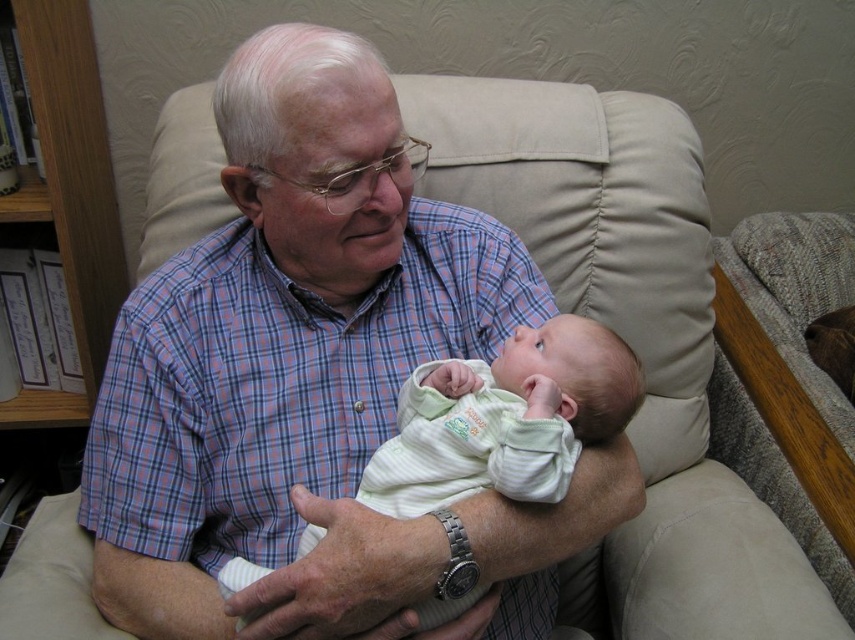
Is plaid shirt at center taller than wooden bookshelf at left?

Incorrect, plaid shirt at center's height is not larger of wooden bookshelf at left's.

Is plaid shirt at center to the right of wooden bookshelf at left from the viewer's perspective?

Indeed, plaid shirt at center is positioned on the right side of wooden bookshelf at left.

Which is in front, point (154, 582) or point (97, 342)?

Positioned in front is point (154, 582).

Locate an element on the screen. plaid shirt at center is located at coordinates (313, 380).

Can you confirm if plaid shirt at center is positioned to the left of light green striped fabric baby at center?

Correct, you'll find plaid shirt at center to the left of light green striped fabric baby at center.

Can you confirm if plaid shirt at center is taller than light green striped fabric baby at center?

Yes, plaid shirt at center is taller than light green striped fabric baby at center.

Which is behind, point (381, 636) or point (497, 486)?

Positioned behind is point (497, 486).

This screenshot has height=640, width=855. Identify the location of plaid shirt at center. (313, 380).

Where is `light green striped fabric baby at center`? The height and width of the screenshot is (640, 855). light green striped fabric baby at center is located at coordinates (504, 419).

Does light green striped fabric baby at center lie in front of wooden bookshelf at left?

Yes, light green striped fabric baby at center is closer to the viewer.

Is point (606, 388) in front of point (111, 289)?

Yes, point (606, 388) is closer to viewer.

The width and height of the screenshot is (855, 640). Find the location of `light green striped fabric baby at center`. light green striped fabric baby at center is located at coordinates (504, 419).